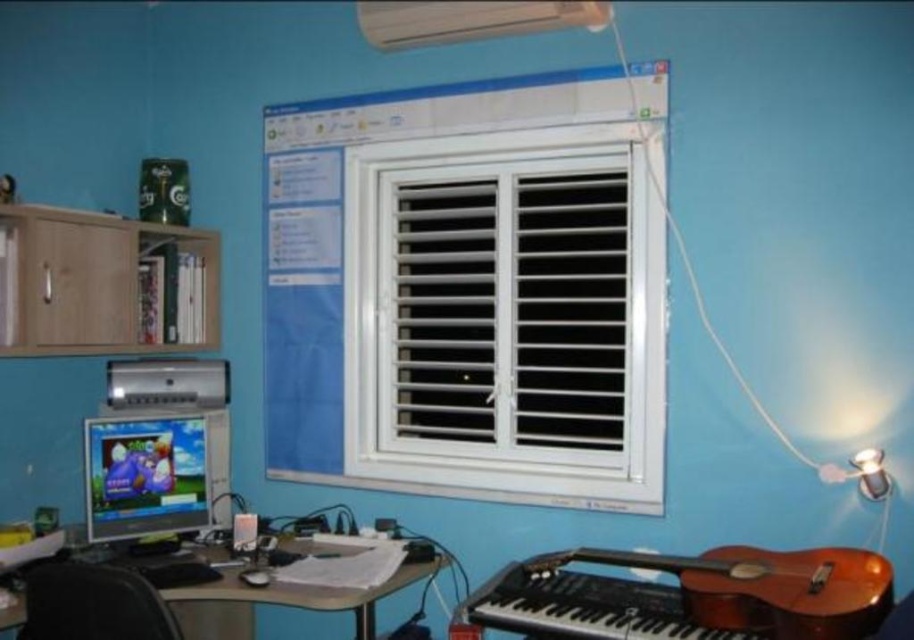
From the picture: Does white plastic window at center appear on the right side of matte black monitor at lower left?

Yes, white plastic window at center is to the right of matte black monitor at lower left.

Is point (612, 476) closer to viewer compared to point (186, 449)?

Yes, point (612, 476) is in front of point (186, 449).

Identify the location of white plastic window at center. (x=506, y=316).

Can you confirm if white plastic window at center is smaller than black leather chair at lower left?

Actually, white plastic window at center might be larger than black leather chair at lower left.

Between point (592, 444) and point (112, 586), which one is positioned in front?

Point (112, 586)

Who is more distant from viewer, [380,154] or [112,632]?

Point [380,154]

Locate an element on the screen. white plastic window at center is located at coordinates (506, 316).

Is white plastic window at center smaller than matte black desk at center?

Incorrect, white plastic window at center is not smaller in size than matte black desk at center.

How much distance is there between white plastic window at center and matte black desk at center?

white plastic window at center is 82.57 centimeters away from matte black desk at center.

The height and width of the screenshot is (640, 914). Describe the element at coordinates (506, 316) in the screenshot. I see `white plastic window at center` at that location.

Locate an element on the screen. white plastic window at center is located at coordinates (506, 316).